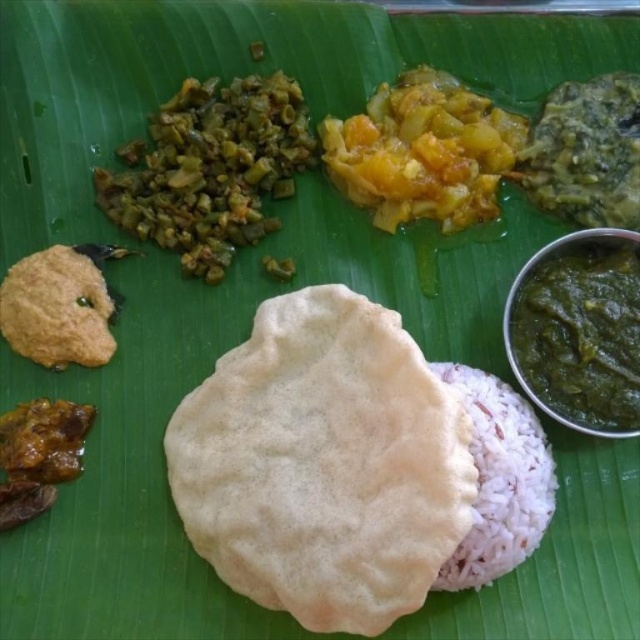
Please describe the position of the white soft flatbread at center relative to the other items on the banana leaf.

The white soft flatbread at center is located at the central part of the banana leaf, positioned at coordinates approximately 0.725 along the x axis and 0.506 along the y axis.

You are a food critic sitting at a table with this South Indian meal. You want to reach for the white soft flatbread at center. Based on the arrangement of the meal on the banana leaf, where should you look to find it?

The white soft flatbread at center is located at the central position on the banana leaf, specifically at the 2D coordinates point [323,464].

You are a guest at a South Indian meal and want to reach for both the white soft flatbread at center and the green paste at right. Which item will your hand need to move less to grab?

The white soft flatbread at center is closer to the viewer than the green paste at right, so you will need to move your hand less to grab the white soft flatbread at center.